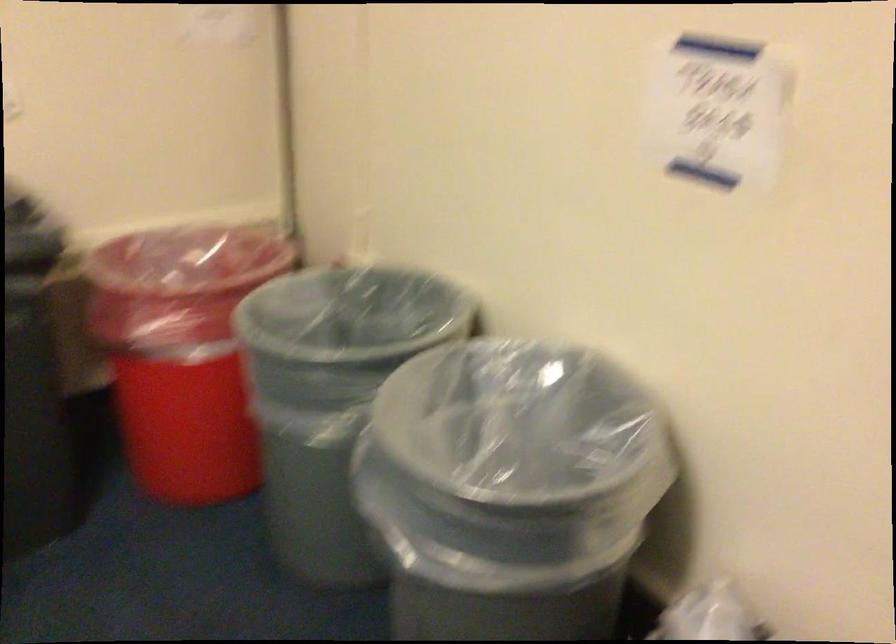
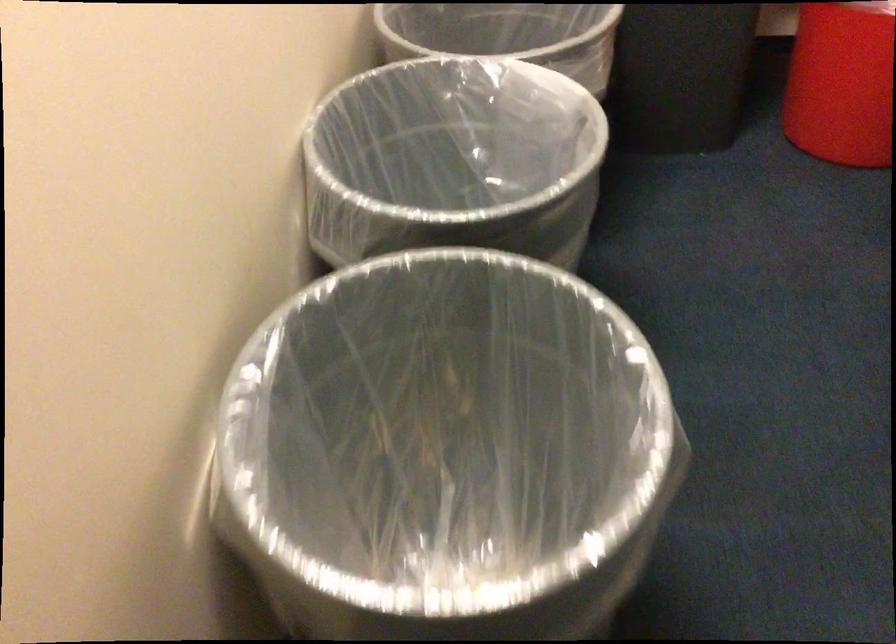
First-person continuous shooting, in which direction is the camera rotating?

The rotation direction of the camera is left-down.